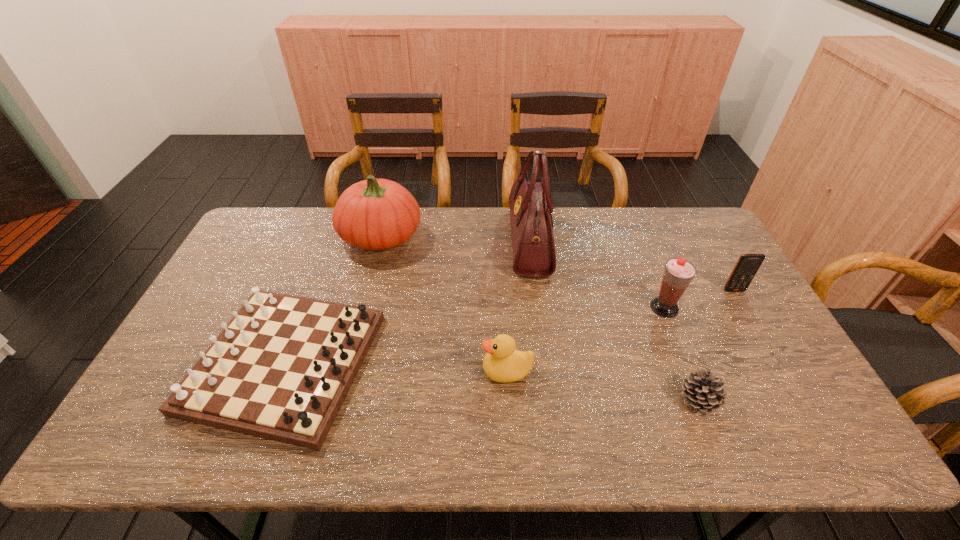
You are a GUI agent. You are given a task and a screenshot of the screen. Output one action in this format:
    pyautogui.click(x=<x>, y=<y>)
    Task: Click on the pumpkin positioned at the far edge
    The width and height of the screenshot is (960, 540).
    Given the screenshot: What is the action you would take?
    tap(375, 214)

The height and width of the screenshot is (540, 960). Find the location of `pinecone at the near edge`. pinecone at the near edge is located at coordinates (703, 392).

In order to click on chessboard present at the near edge in this screenshot , I will do `click(281, 369)`.

Identify the location of object at the left edge. (281, 369).

Locate an element on the screen. The width and height of the screenshot is (960, 540). object present at the right edge is located at coordinates (748, 264).

Locate an element on the screen. The width and height of the screenshot is (960, 540). object that is at the near left corner is located at coordinates (281, 369).

Where is `free space at the far edge`? The width and height of the screenshot is (960, 540). free space at the far edge is located at coordinates (654, 211).

At what (x,y) coordinates should I click in order to perform the action: click on vacant point located between the pinecone and the tallest object. Please return your answer as a coordinate pair (x, y). The image size is (960, 540). Looking at the image, I should click on (614, 321).

The height and width of the screenshot is (540, 960). What are the coordinates of `vacant area that lies between the pumpkin and the handbag` in the screenshot? It's located at (455, 239).

In order to click on vacant region between the chessboard and the rightmost object in this screenshot , I will do `click(510, 327)`.